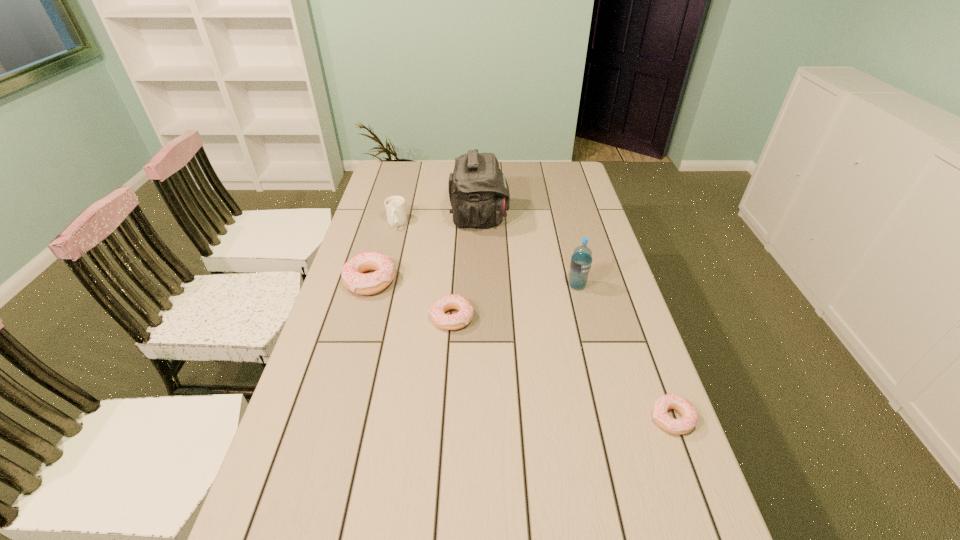
This screenshot has width=960, height=540. In order to click on free space located on the right of the tallest doughnut in this screenshot , I will do `click(419, 280)`.

The width and height of the screenshot is (960, 540). Identify the location of vacant space located 0.350m on the front of the second doughnut from right to left. (443, 452).

Image resolution: width=960 pixels, height=540 pixels. Identify the location of vacant space situated 0.370m on the left of the nearest doughnut. (493, 418).

The width and height of the screenshot is (960, 540). Identify the location of vacant space located on the open flap of the tallest object. point(562,218).

I want to click on free location located on the side with the handle of the cappuccino, so click(x=375, y=307).

Locate an element on the screen. blank space located 0.130m on the front of the fifth shortest object is located at coordinates (586, 323).

The image size is (960, 540). Find the location of `doughnut located in the left edge section of the desktop`. doughnut located in the left edge section of the desktop is located at coordinates (353, 278).

The width and height of the screenshot is (960, 540). In order to click on cappuccino situated at the left edge in this screenshot , I will do tap(395, 207).

This screenshot has width=960, height=540. Find the location of `doughnut located at the right edge`. doughnut located at the right edge is located at coordinates (689, 420).

This screenshot has height=540, width=960. I want to click on water bottle present at the right edge, so click(581, 260).